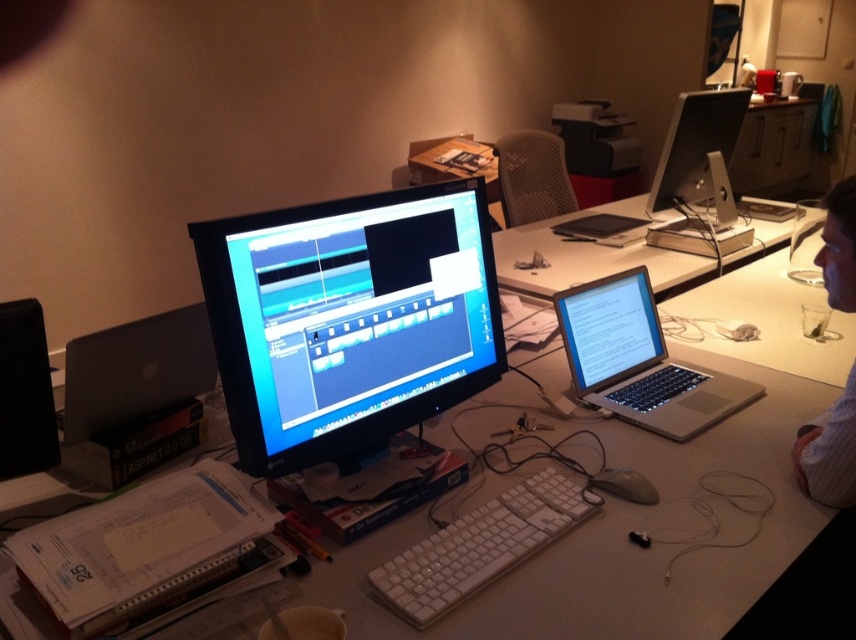
Describe the element at coordinates (696, 147) in the screenshot. I see `satin black monitor at upper right` at that location.

Does point (691, 148) come behind point (599, 472)?

That is True.

Is point (679, 145) positioned in front of point (593, 476)?

No, (679, 145) is behind (593, 476).

Locate an element on the screen. This screenshot has width=856, height=640. satin black monitor at upper right is located at coordinates (696, 147).

Who is lower down, white plastic keyboard at center or white striped shirt at right?

Positioned lower is white plastic keyboard at center.

Does white plastic keyboard at center appear under white striped shirt at right?

Yes, white plastic keyboard at center is below white striped shirt at right.

Is point (428, 560) farther from viewer compared to point (848, 188)?

That is False.

What are the coordinates of `white plastic keyboard at center` in the screenshot? It's located at (479, 547).

Is point (625, 336) farther from viewer compared to point (623, 488)?

Yes, point (625, 336) is behind point (623, 488).

Is silver metallic laptop at center taller than white plastic mouse at lower center?

Correct, silver metallic laptop at center is much taller as white plastic mouse at lower center.

Image resolution: width=856 pixels, height=640 pixels. I want to click on silver metallic laptop at center, so click(x=638, y=360).

Locate an element on the screen. This screenshot has width=856, height=640. silver metallic laptop at center is located at coordinates (638, 360).